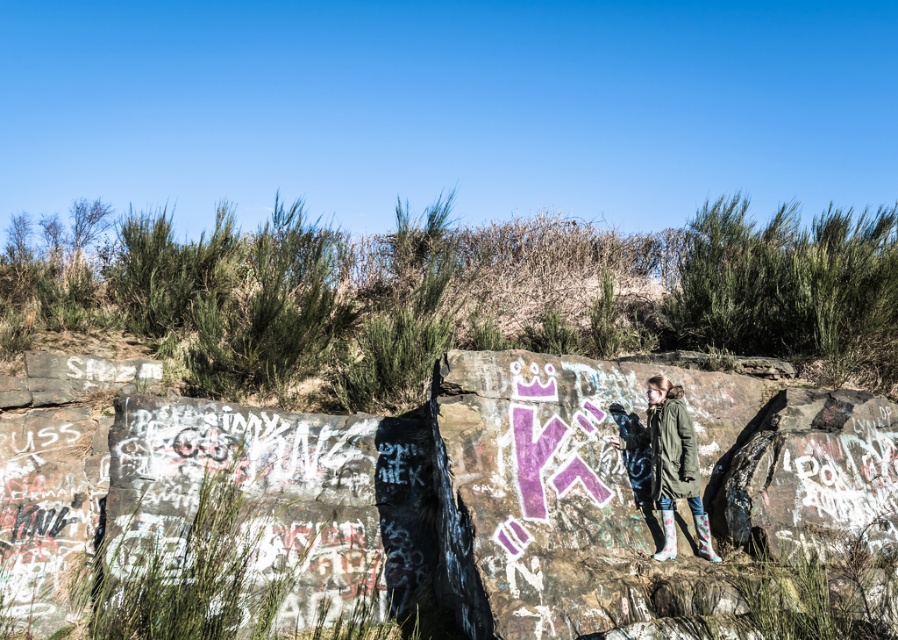
Question: Based on their relative distances, which object is nearer to the rocky cliff at center?

Choices:
 (A) green grass at center
 (B) green matte jacket at center

Answer: (B)

Question: Is green grass at center to the right of green matte jacket at center from the viewer's perspective?

Choices:
 (A) no
 (B) yes

Answer: (A)

Question: Which of the following is the closest to the observer?

Choices:
 (A) (208, 413)
 (B) (654, 556)
 (C) (612, 269)

Answer: (B)

Question: Is rocky cliff at center to the left of green grass at center from the viewer's perspective?

Choices:
 (A) yes
 (B) no

Answer: (B)

Question: In this image, where is green grass at center located relative to green matte jacket at center?

Choices:
 (A) left
 (B) right

Answer: (A)

Question: Which point is closer to the camera?

Choices:
 (A) (800, 272)
 (B) (685, 444)
 (C) (521, 488)

Answer: (C)